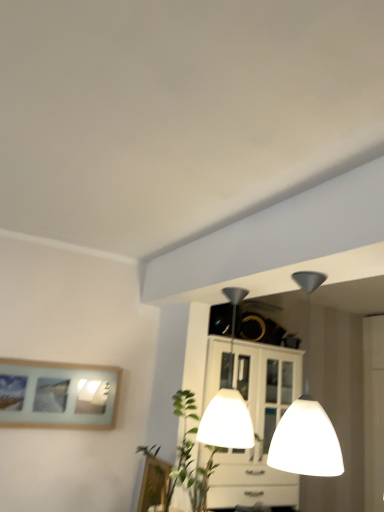
This screenshot has height=512, width=384. I want to click on white glossy lampshade at upper center, marked as the second lamp in a back-to-front arrangement, so click(306, 418).

How much space does wooden picture frame at lower center, arranged as the first picture frame when viewed from the right, occupy vertically?

12.86 inches.

The image size is (384, 512). Describe the element at coordinates (228, 403) in the screenshot. I see `white glossy lampshade at center, which is the 2th lamp in front-to-back order` at that location.

I want to click on green leafy plant at center, so click(189, 458).

Which of these two, wooden framed picture at left, positioned as the 1th picture frame in top-to-bottom order, or green leafy plant at center, stands shorter?

wooden framed picture at left, positioned as the 1th picture frame in top-to-bottom order.

Does wooden framed picture at left, the 2th picture frame ordered from the bottom, appear on the left side of green leafy plant at center?

Indeed, wooden framed picture at left, the 2th picture frame ordered from the bottom, is positioned on the left side of green leafy plant at center.

Which object is wider, wooden framed picture at left, positioned as the 1th picture frame in top-to-bottom order, or green leafy plant at center?

green leafy plant at center is wider.

Which object is wider, wooden picture frame at lower center, the first picture frame in the bottom-to-top sequence, or wooden framed picture at left, marked as the 2th picture frame in a right-to-left arrangement?

Wider between the two is wooden picture frame at lower center, the first picture frame in the bottom-to-top sequence.

Would you say wooden picture frame at lower center, arranged as the first picture frame when viewed from the right, contains wooden framed picture at left, the first picture frame viewed from the left?

Actually, wooden framed picture at left, the first picture frame viewed from the left, is outside wooden picture frame at lower center, arranged as the first picture frame when viewed from the right.

From the image's perspective, between wooden picture frame at lower center, the 2th picture frame from the top, and wooden framed picture at left, positioned as the 1th picture frame in top-to-bottom order, who is located below?

wooden picture frame at lower center, the 2th picture frame from the top, is shown below in the image.

This screenshot has height=512, width=384. In order to click on picture frame located in front of the wooden framed picture at left, positioned as the 1th picture frame in top-to-bottom order in this screenshot , I will do `click(153, 483)`.

From the image's perspective, who appears lower, wooden framed picture at left, marked as the 2th picture frame in a right-to-left arrangement, or wooden picture frame at lower center, the 2th picture frame from the top?

wooden picture frame at lower center, the 2th picture frame from the top, is shown below in the image.

Looking at this image, would you say wooden picture frame at lower center, the 2th picture frame from the top, is part of wooden framed picture at left, the first picture frame viewed from the left,'s contents?

Actually, wooden picture frame at lower center, the 2th picture frame from the top, is outside wooden framed picture at left, the first picture frame viewed from the left.

How much distance is there between white glossy lampshade at center, which is the 2th lamp in front-to-back order, and green leafy plant at center?

They are 12.56 inches apart.

Does white glossy lampshade at center, which is the 2th lamp in front-to-back order, have a larger size compared to green leafy plant at center?

Yes.

Does white glossy lampshade at center, acting as the first lamp starting from the back, touch green leafy plant at center?

white glossy lampshade at center, acting as the first lamp starting from the back, and green leafy plant at center are not in contact.

In the scene shown: Does white glossy lampshade at center, which is the 2th lamp in front-to-back order, appear on the right side of green leafy plant at center?

Indeed, white glossy lampshade at center, which is the 2th lamp in front-to-back order, is positioned on the right side of green leafy plant at center.

Does point (308, 323) come closer to viewer compared to point (247, 432)?

No, it is behind (247, 432).

Considering the sizes of objects white glossy lampshade at upper center, marked as the second lamp in a back-to-front arrangement, and green leafy plant at center in the image provided, who is shorter, white glossy lampshade at upper center, marked as the second lamp in a back-to-front arrangement, or green leafy plant at center?

With less height is green leafy plant at center.

Considering the sizes of white glossy lampshade at upper center, marked as the second lamp in a back-to-front arrangement, and wooden framed picture at left, marked as the 2th picture frame in a right-to-left arrangement, in the image, is white glossy lampshade at upper center, marked as the second lamp in a back-to-front arrangement, taller or shorter than wooden framed picture at left, marked as the 2th picture frame in a right-to-left arrangement,?

In the image, white glossy lampshade at upper center, marked as the second lamp in a back-to-front arrangement, appears to be taller than wooden framed picture at left, marked as the 2th picture frame in a right-to-left arrangement.

Is white glossy lampshade at upper center, marked as the second lamp in a back-to-front arrangement, next to wooden framed picture at left, the first picture frame viewed from the left?

No.

How different are the orientations of white glossy lampshade at upper center, acting as the first lamp starting from the front, and wooden framed picture at left, marked as the 2th picture frame in a right-to-left arrangement, in degrees?

There is a 86.8-degree angle between the facing directions of white glossy lampshade at upper center, acting as the first lamp starting from the front, and wooden framed picture at left, marked as the 2th picture frame in a right-to-left arrangement.

Considering the sizes of white glossy lampshade at upper center, acting as the first lamp starting from the front, and wooden framed picture at left, the 2th picture frame ordered from the bottom, in the image, is white glossy lampshade at upper center, acting as the first lamp starting from the front, bigger or smaller than wooden framed picture at left, the 2th picture frame ordered from the bottom,?

Considering their sizes, white glossy lampshade at upper center, acting as the first lamp starting from the front, takes up more space than wooden framed picture at left, the 2th picture frame ordered from the bottom.

Which object is positioned more to the left, green leafy plant at center or wooden picture frame at lower center, the first picture frame in the bottom-to-top sequence?

wooden picture frame at lower center, the first picture frame in the bottom-to-top sequence, is more to the left.

Could you measure the distance between green leafy plant at center and wooden picture frame at lower center, the first picture frame in the bottom-to-top sequence?

green leafy plant at center is 6.36 inches from wooden picture frame at lower center, the first picture frame in the bottom-to-top sequence.

Identify the location of plant lying on the right of wooden picture frame at lower center, the first picture frame in the bottom-to-top sequence. This screenshot has height=512, width=384. (189, 458).

From a real-world perspective, between green leafy plant at center and wooden picture frame at lower center, the 2th picture frame from the top, who is vertically higher?

green leafy plant at center is physically above.

The width and height of the screenshot is (384, 512). I want to click on picture frame that is the 2nd one when counting backward from the green leafy plant at center, so click(x=59, y=395).

In the image, there is a wooden picture frame at lower center, the first picture frame in the bottom-to-top sequence. Identify the location of picture frame above it (from the image's perspective). The image size is (384, 512). (59, 395).

Estimate the real-world distances between objects in this image. Which object is closer to white glossy lampshade at center, which is the 2th lamp in front-to-back order, white glossy lampshade at upper center, marked as the second lamp in a back-to-front arrangement, or wooden picture frame at lower center, the first picture frame in the bottom-to-top sequence?

Among the two, wooden picture frame at lower center, the first picture frame in the bottom-to-top sequence, is located nearer to white glossy lampshade at center, which is the 2th lamp in front-to-back order.

When comparing their distances from wooden framed picture at left, positioned as the 1th picture frame in top-to-bottom order, does white glossy lampshade at center, which is the 2th lamp in front-to-back order, or green leafy plant at center seem closer?

Result: Based on the image, green leafy plant at center appears to be nearer to wooden framed picture at left, positioned as the 1th picture frame in top-to-bottom order.

Which object lies nearer to the anchor point white glossy lampshade at center, acting as the first lamp starting from the back, wooden framed picture at left, positioned as the 1th picture frame in top-to-bottom order, or wooden picture frame at lower center, arranged as the first picture frame when viewed from the right?

wooden picture frame at lower center, arranged as the first picture frame when viewed from the right, is positioned closer to the anchor white glossy lampshade at center, acting as the first lamp starting from the back.

When comparing their distances from white glossy lampshade at upper center, acting as the first lamp starting from the front, does white glossy lampshade at center, which is the 2th lamp in front-to-back order, or wooden picture frame at lower center, the 2th picture frame in the left-to-right sequence, seem further?

white glossy lampshade at center, which is the 2th lamp in front-to-back order, is positioned further to the anchor white glossy lampshade at upper center, acting as the first lamp starting from the front.

Based on their spatial positions, is wooden framed picture at left, marked as the 2th picture frame in a right-to-left arrangement, or white glossy lampshade at center, acting as the first lamp starting from the back, closer to green leafy plant at center?

white glossy lampshade at center, acting as the first lamp starting from the back, lies closer to green leafy plant at center than the other object.

Looking at the image, which one is located further to white glossy lampshade at upper center, marked as the second lamp in a back-to-front arrangement, green leafy plant at center or wooden picture frame at lower center, the 2th picture frame from the top?

wooden picture frame at lower center, the 2th picture frame from the top, lies further to white glossy lampshade at upper center, marked as the second lamp in a back-to-front arrangement, than the other object.

Which object lies further to the anchor point wooden framed picture at left, the first picture frame viewed from the left, wooden picture frame at lower center, arranged as the first picture frame when viewed from the right, or white glossy lampshade at upper center, marked as the second lamp in a back-to-front arrangement?

white glossy lampshade at upper center, marked as the second lamp in a back-to-front arrangement.

When comparing their distances from white glossy lampshade at upper center, acting as the first lamp starting from the front, does wooden framed picture at left, the first picture frame viewed from the left, or white glossy lampshade at center, acting as the first lamp starting from the back, seem further?

wooden framed picture at left, the first picture frame viewed from the left, lies further to white glossy lampshade at upper center, acting as the first lamp starting from the front, than the other object.

You are a GUI agent. You are given a task and a screenshot of the screen. Output one action in this format:
    pyautogui.click(x=<x>, y=<y>)
    Task: Click on the plant between white glossy lampshade at center, acting as the first lamp starting from the back, and wooden picture frame at lower center, the 2th picture frame in the left-to-right sequence, vertically
    
    Given the screenshot: What is the action you would take?
    pyautogui.click(x=189, y=458)

At what (x,y) coordinates should I click in order to perform the action: click on picture frame between wooden framed picture at left, marked as the 2th picture frame in a right-to-left arrangement, and white glossy lampshade at upper center, acting as the first lamp starting from the front, in the horizontal direction. Please return your answer as a coordinate pair (x, y). The width and height of the screenshot is (384, 512). Looking at the image, I should click on (153, 483).

Find the location of a particular element. lamp between white glossy lampshade at upper center, acting as the first lamp starting from the front, and wooden picture frame at lower center, arranged as the first picture frame when viewed from the right, in the vertical direction is located at coordinates coord(228,403).

Locate an element on the screen. lamp situated between wooden framed picture at left, the first picture frame viewed from the left, and white glossy lampshade at upper center, acting as the first lamp starting from the front, from left to right is located at coordinates (228, 403).